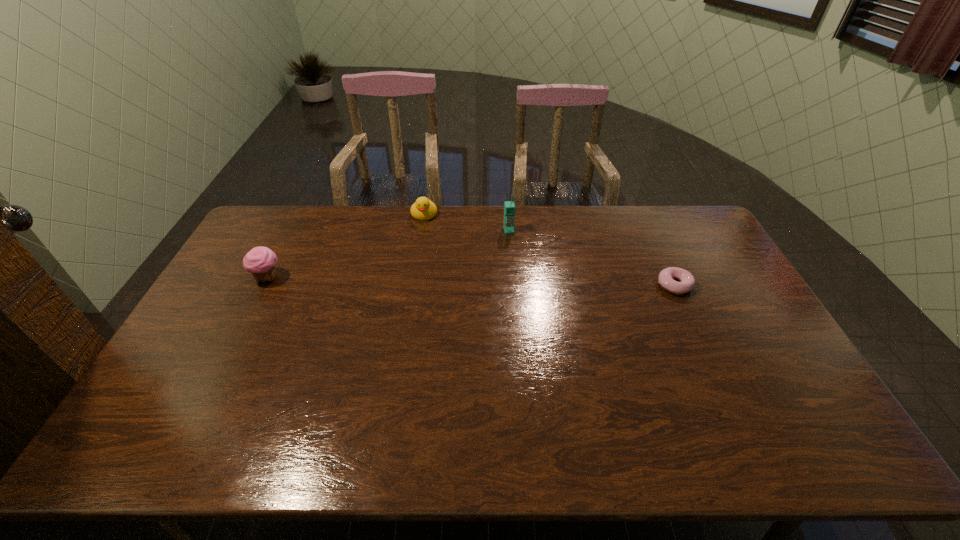
Identify the location of vacant space situated on the keypad of the tallest object. (529, 311).

Identify the location of vacant position located 0.180m on the keypad of the tallest object. (518, 267).

Find the location of a particular element. vacant position located 0.400m on the keypad of the tallest object is located at coordinates (531, 316).

The width and height of the screenshot is (960, 540). I want to click on vacant space located on the face of the duckling, so click(418, 271).

Where is `vacant region located 0.070m on the face of the duckling`? The image size is (960, 540). vacant region located 0.070m on the face of the duckling is located at coordinates (421, 234).

Where is `free space located on the face of the duckling`? The image size is (960, 540). free space located on the face of the duckling is located at coordinates (419, 265).

In order to click on cellular telephone that is positioned at the far edge in this screenshot , I will do click(509, 207).

Locate an element on the screen. The image size is (960, 540). duckling present at the far edge is located at coordinates (423, 209).

Image resolution: width=960 pixels, height=540 pixels. Identify the location of object that is at the left edge. (261, 261).

Find the location of a particular element. The width and height of the screenshot is (960, 540). object at the right edge is located at coordinates (666, 277).